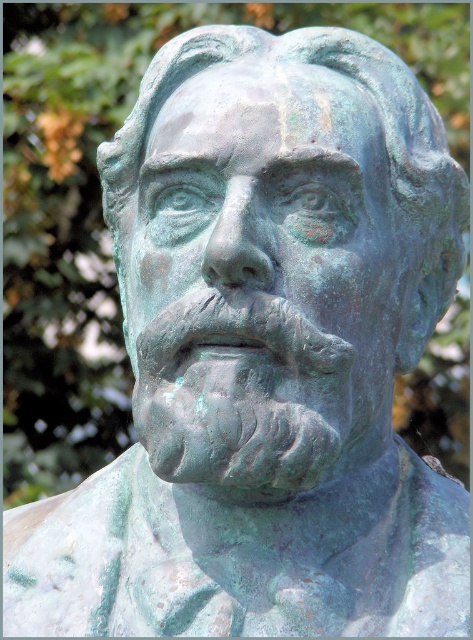
This screenshot has width=473, height=640. What do you see at coordinates (261, 280) in the screenshot?
I see `green patina bust at center` at bounding box center [261, 280].

Does green patina bust at center have a lesser width compared to green patina nose at center?

No, green patina bust at center is not thinner than green patina nose at center.

Where is `green patina bust at center`? green patina bust at center is located at coordinates (261, 280).

Find the location of a particular element. The image size is (473, 640). green patina bust at center is located at coordinates (261, 280).